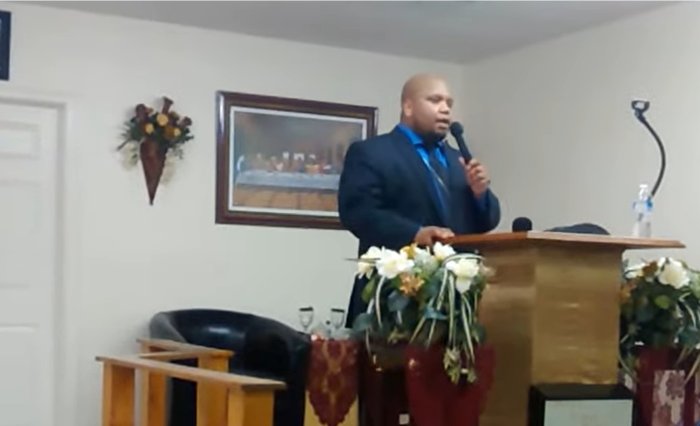
The image size is (700, 426). Find the location of `ceiling`. ceiling is located at coordinates click(382, 29).